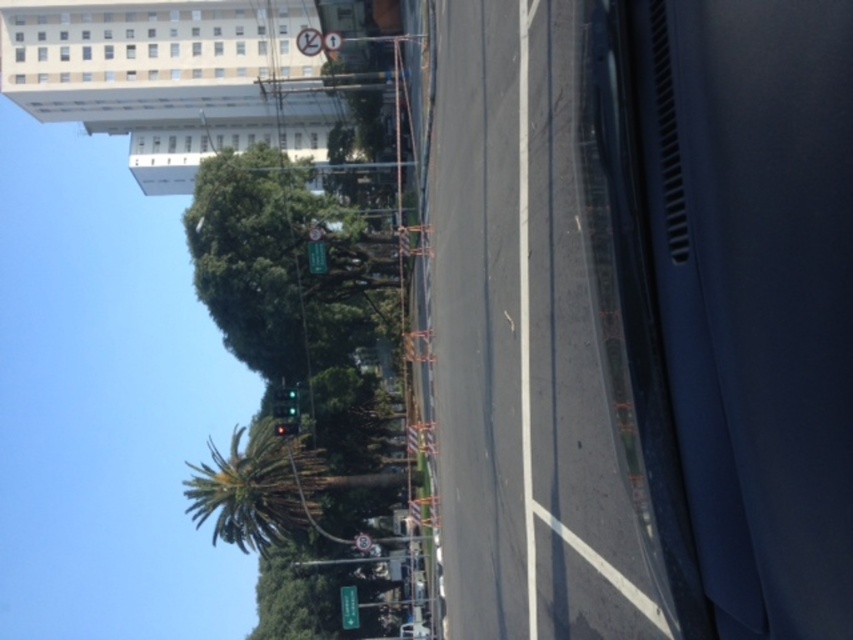
Does green leafy tree at center appear over green leafy palm tree at center?

Yes.

Describe the element at coordinates (296, 298) in the screenshot. This screenshot has height=640, width=853. I see `green leafy tree at center` at that location.

Is point (349, 236) more distant than point (305, 465)?

Yes, point (349, 236) is behind point (305, 465).

What are the coordinates of `green leafy tree at center` in the screenshot? It's located at point(296,298).

Who is higher up, green leafy palm tree at center or green matte street sign at lower center?

Positioned higher is green leafy palm tree at center.

I want to click on green leafy palm tree at center, so click(256, 486).

Does green glass traffic light at upper center have a smaller size compared to green matte street sign at lower center?

Incorrect, green glass traffic light at upper center is not smaller in size than green matte street sign at lower center.

Can you confirm if green glass traffic light at upper center is positioned to the right of green matte street sign at lower center?

In fact, green glass traffic light at upper center is to the left of green matte street sign at lower center.

Find the location of `green glass traffic light at upper center`. green glass traffic light at upper center is located at coordinates (285, 403).

At what (x,y) coordinates should I click in order to perform the action: click on green glass traffic light at upper center. Please return your answer as a coordinate pair (x, y). The height and width of the screenshot is (640, 853). Looking at the image, I should click on (285, 403).